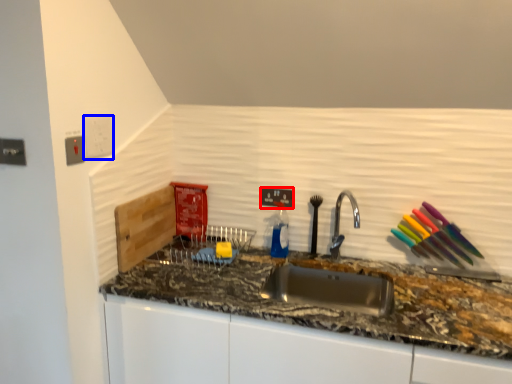
Question: Which point is further to the camera, electric outlet (highlighted by a red box) or electric outlet (highlighted by a blue box)?

Choices:
 (A) electric outlet
 (B) electric outlet

Answer: (A)